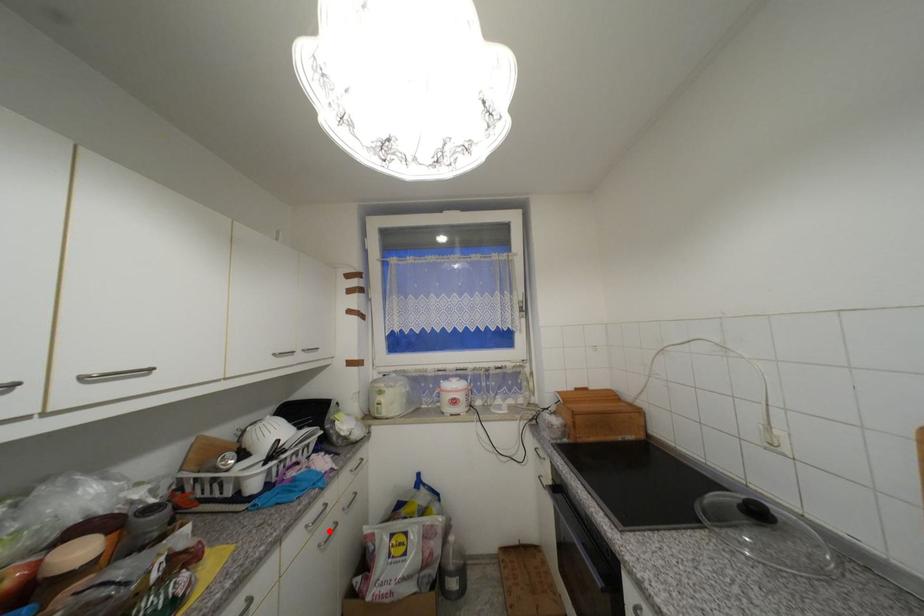
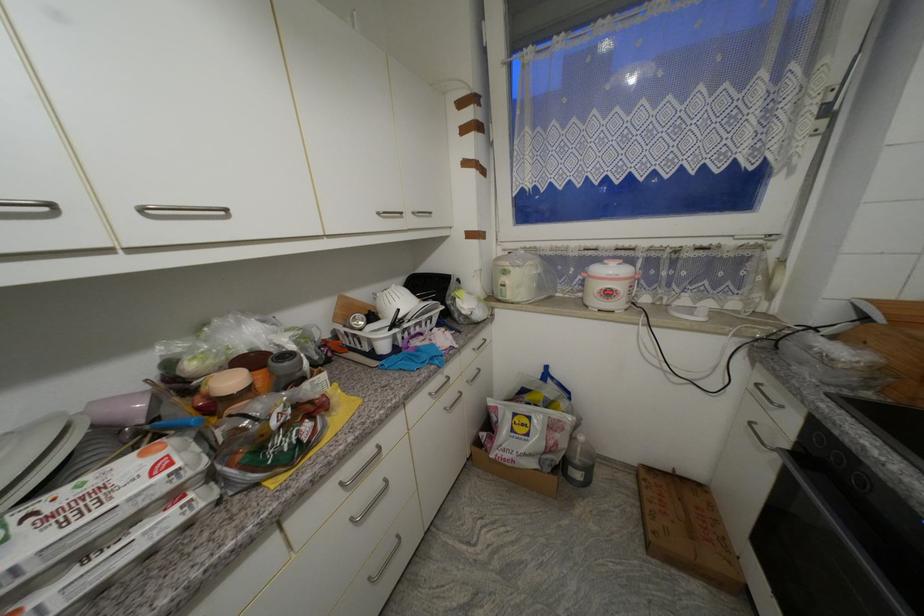
Question: I am providing you with two images of the same scene from different viewpoints. Image1 has a red point marked. In image2, the corresponding 3D location appears at what relative position? Reply with the corresponding letter.

Choices:
 (A) Closer
 (B) Farther

Answer: (B)